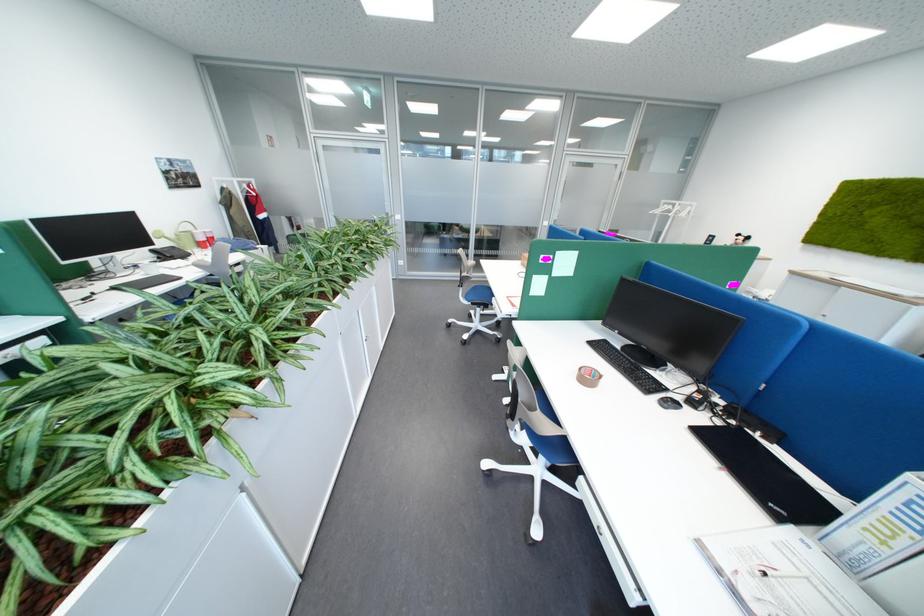
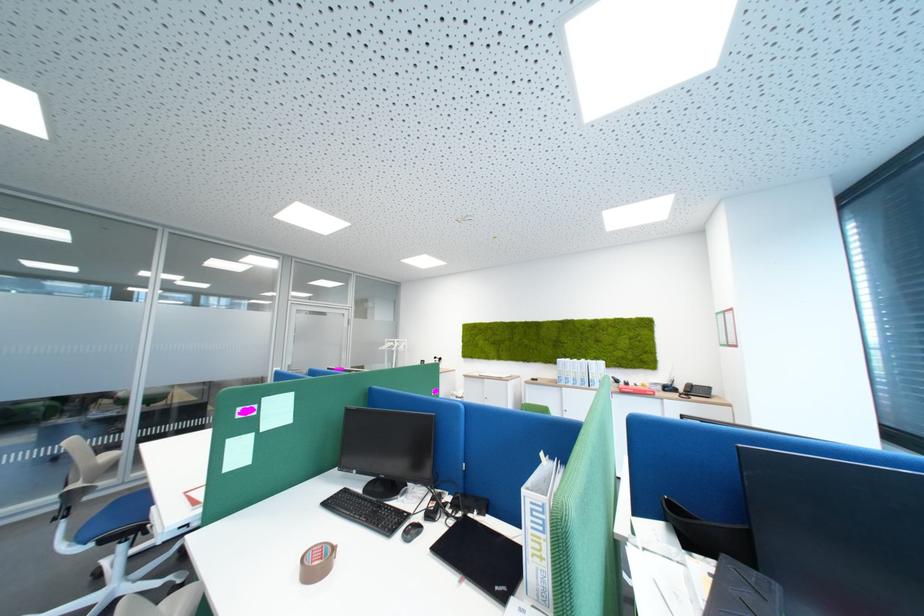
Locate, in the second image, the point that corresponds to point 660,392 in the first image.

(403, 533)